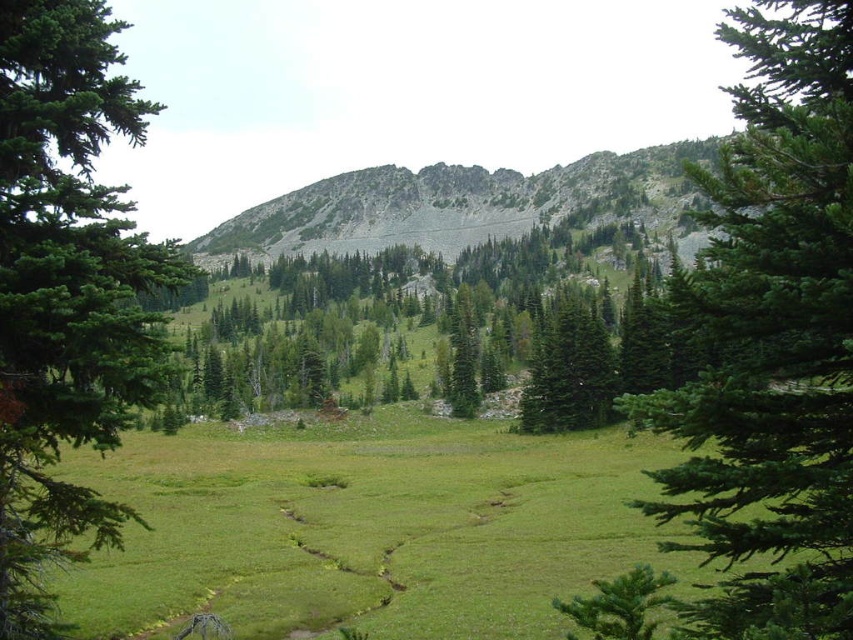
Does green matte tree at center have a larger size compared to green textured tree at center?

Yes.

Does green matte tree at center have a greater height compared to green textured tree at center?

Incorrect, green matte tree at center's height is not larger of green textured tree at center's.

Is point (531, 364) positioned after point (465, 339)?

That is False.

In order to click on green matte tree at center in this screenshot , I will do `click(567, 371)`.

Can you confirm if green needle-like tree at left is smaller than gray rocky mountain at center?

Yes, green needle-like tree at left is smaller than gray rocky mountain at center.

The image size is (853, 640). What do you see at coordinates (65, 289) in the screenshot?
I see `green needle-like tree at left` at bounding box center [65, 289].

Is point (149, 337) behind point (453, 164)?

No, it is not.

The width and height of the screenshot is (853, 640). What are the coordinates of `green needle-like tree at left` in the screenshot? It's located at (65, 289).

Does green needle-like tree at left have a greater width compared to green matte tree at center?

Yes.

The image size is (853, 640). What do you see at coordinates (65, 289) in the screenshot?
I see `green needle-like tree at left` at bounding box center [65, 289].

The image size is (853, 640). Find the location of `green needle-like tree at left`. green needle-like tree at left is located at coordinates (65, 289).

Where is `green needle-like tree at left`? green needle-like tree at left is located at coordinates (65, 289).